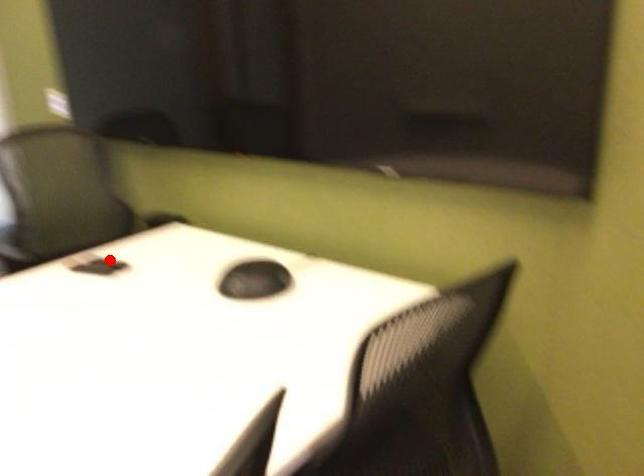
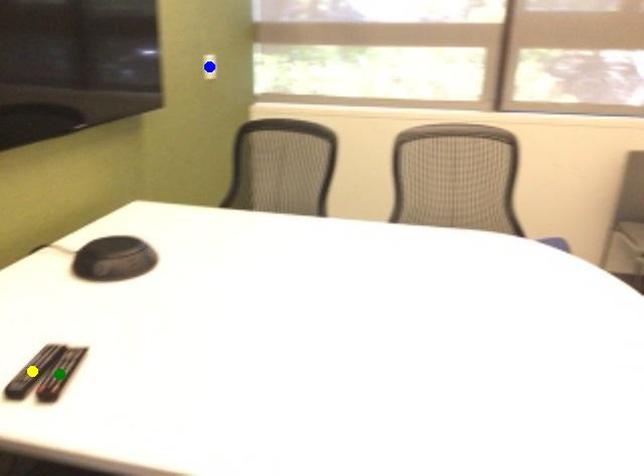
Question: I am providing you with two images of the same scene from different viewpoints. A red point is marked on the first image. You are given multiple points on the second image. In image 2, which mark is for the same physical point as the one in image 1?

Choices:
 (A) green point
 (B) blue point
 (C) yellow point

Answer: (C)